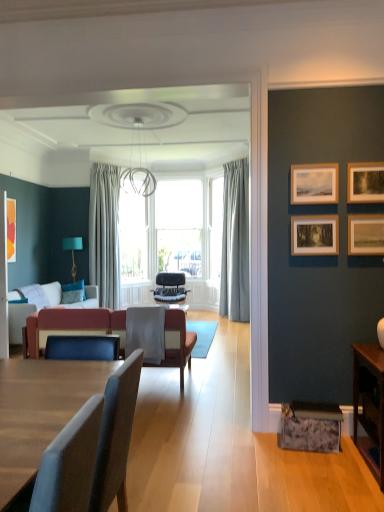
Question: Could you tell me if wooden picture frame at upper right, positioned as the 4th picture frame in back-to-front order, is turned towards velvet red couch at center?

Choices:
 (A) no
 (B) yes

Answer: (A)

Question: From the image's perspective, is wooden picture frame at upper right, acting as the 2th picture frame starting from the right, below velvet red couch at center?

Choices:
 (A) yes
 (B) no

Answer: (B)

Question: Can you confirm if wooden picture frame at upper right, the third picture frame when ordered from left to right, is wider than velvet red couch at center?

Choices:
 (A) yes
 (B) no

Answer: (B)

Question: Considering the relative positions of wooden picture frame at upper right, the first picture frame in the front-to-back sequence, and velvet red couch at center in the image provided, is wooden picture frame at upper right, the first picture frame in the front-to-back sequence, to the right of velvet red couch at center from the viewer's perspective?

Choices:
 (A) yes
 (B) no

Answer: (A)

Question: Can you confirm if wooden picture frame at upper right, the first picture frame in the front-to-back sequence, is thinner than velvet red couch at center?

Choices:
 (A) yes
 (B) no

Answer: (A)

Question: Is fabric cushioned chair at center, arranged as the first chair when viewed from the front, in contact with velvet red couch at left?

Choices:
 (A) no
 (B) yes

Answer: (A)

Question: Is fabric cushioned chair at center, arranged as the first chair when viewed from the front, at the left side of velvet red couch at left?

Choices:
 (A) no
 (B) yes

Answer: (A)

Question: Can you confirm if fabric cushioned chair at center, arranged as the first chair when viewed from the front, is thinner than velvet red couch at left?

Choices:
 (A) no
 (B) yes

Answer: (B)

Question: Is fabric cushioned chair at center, arranged as the first chair when viewed from the front, taller than velvet red couch at left?

Choices:
 (A) yes
 (B) no

Answer: (A)

Question: From a real-world perspective, is fabric cushioned chair at center, placed as the second chair when sorted from back to front, positioned under velvet red couch at left based on gravity?

Choices:
 (A) no
 (B) yes

Answer: (A)

Question: From a real-world perspective, is fabric cushioned chair at center, placed as the second chair when sorted from back to front, positioned over velvet red couch at left based on gravity?

Choices:
 (A) no
 (B) yes

Answer: (B)

Question: Are velvet red couch at center and wooden table at lower right beside each other?

Choices:
 (A) no
 (B) yes

Answer: (A)